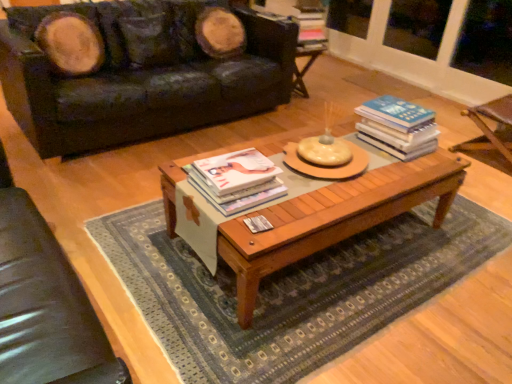
Question: Does leather couch at upper left turn towards wooden armchair at right, the 1th armchair in the back-to-front sequence?

Choices:
 (A) yes
 (B) no

Answer: (B)

Question: Does leather couch at upper left have a greater height compared to wooden armchair at right, the 1th armchair in the back-to-front sequence?

Choices:
 (A) yes
 (B) no

Answer: (A)

Question: Can you confirm if leather couch at upper left is positioned to the right of wooden armchair at right, positioned as the 1th armchair in right-to-left order?

Choices:
 (A) no
 (B) yes

Answer: (A)

Question: Is leather couch at upper left next to wooden armchair at right, which ranks as the 2th armchair in left-to-right order, and touching it?

Choices:
 (A) yes
 (B) no

Answer: (B)

Question: Can you confirm if leather couch at upper left is bigger than wooden armchair at right, marked as the second armchair in a front-to-back arrangement?

Choices:
 (A) no
 (B) yes

Answer: (B)

Question: Considering the positions of wooden armchair at right, positioned as the 1th armchair in right-to-left order, and hardcover book at center, which is the 2th book in bottom-to-top order, in the image, is wooden armchair at right, positioned as the 1th armchair in right-to-left order, bigger or smaller than hardcover book at center, which is the 2th book in bottom-to-top order,?

Choices:
 (A) big
 (B) small

Answer: (A)

Question: In the image, is wooden armchair at right, the 1th armchair in the back-to-front sequence, on the left side or the right side of hardcover book at center, arranged as the first book when viewed from the top?

Choices:
 (A) right
 (B) left

Answer: (A)

Question: Is wooden armchair at right, which ranks as the 2th armchair in left-to-right order, situated inside hardcover book at center, which appears as the first book when viewed from the right, or outside?

Choices:
 (A) outside
 (B) inside

Answer: (A)

Question: In the image, is wooden armchair at right, positioned as the 1th armchair in right-to-left order, positioned in front of or behind hardcover book at center, which is the second book in front-to-back order?

Choices:
 (A) behind
 (B) front

Answer: (A)

Question: Is leather couch at upper left inside the boundaries of wooden coffee table at center, or outside?

Choices:
 (A) inside
 (B) outside

Answer: (B)

Question: Relative to wooden coffee table at center, is leather couch at upper left in front or behind?

Choices:
 (A) behind
 (B) front

Answer: (A)

Question: Based on their sizes in the image, would you say leather couch at upper left is bigger or smaller than wooden coffee table at center?

Choices:
 (A) small
 (B) big

Answer: (B)

Question: Is leather couch at upper left to the left or to the right of wooden coffee table at center in the image?

Choices:
 (A) right
 (B) left

Answer: (B)

Question: Relative to hardcover book at center, the 2th book positioned from the left, is matte white book at center, which is counted as the 2th book, starting from the back, in front or behind?

Choices:
 (A) behind
 (B) front

Answer: (B)

Question: Is matte white book at center, arranged as the second book when viewed from the top, bigger or smaller than hardcover book at center, the 2th book positioned from the left?

Choices:
 (A) small
 (B) big

Answer: (A)